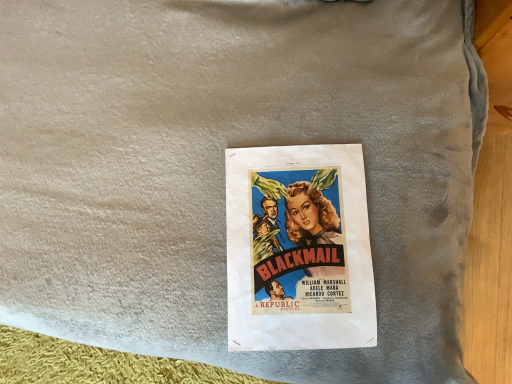
What is the approximate width of vintage paper poster at center?

The width of vintage paper poster at center is 12.09 inches.

Based on the photo, measure the distance between vintage paper poster at center and camera.

23.63 inches.

This screenshot has width=512, height=384. What do you see at coordinates (298, 249) in the screenshot?
I see `vintage paper poster at center` at bounding box center [298, 249].

Locate an element on the screen. The height and width of the screenshot is (384, 512). vintage paper poster at center is located at coordinates (298, 249).

Identify the location of vintage paper poster at center. The height and width of the screenshot is (384, 512). (298, 249).